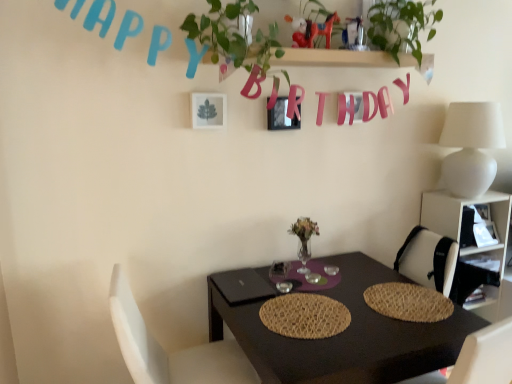
This screenshot has width=512, height=384. I want to click on vacant space in front of woven straw placemat at center, the second mat positioned from the left, so click(412, 334).